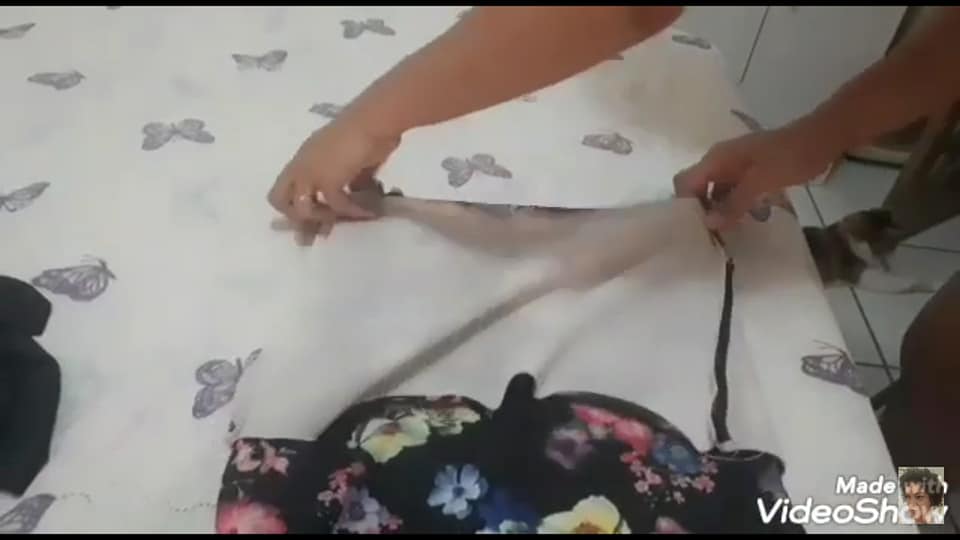
Locate an element on the screen. furniture in background is located at coordinates (808, 42).